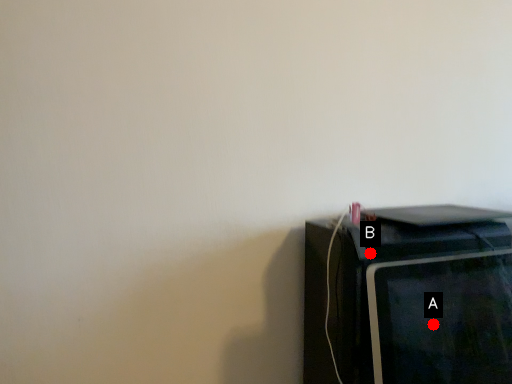
Question: Two points are circled on the image, labeled by A and B beside each circle. Which point is farther to the camera?

Choices:
 (A) A is further
 (B) B is further

Answer: (B)